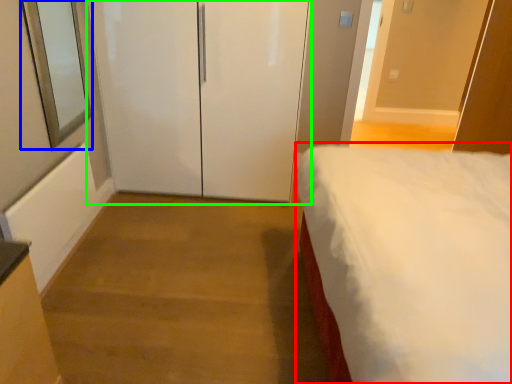
Question: Which is nearer to the bed (highlighted by a red box)? window screen (highlighted by a blue box) or door (highlighted by a green box).

Choices:
 (A) window screen
 (B) door

Answer: (B)